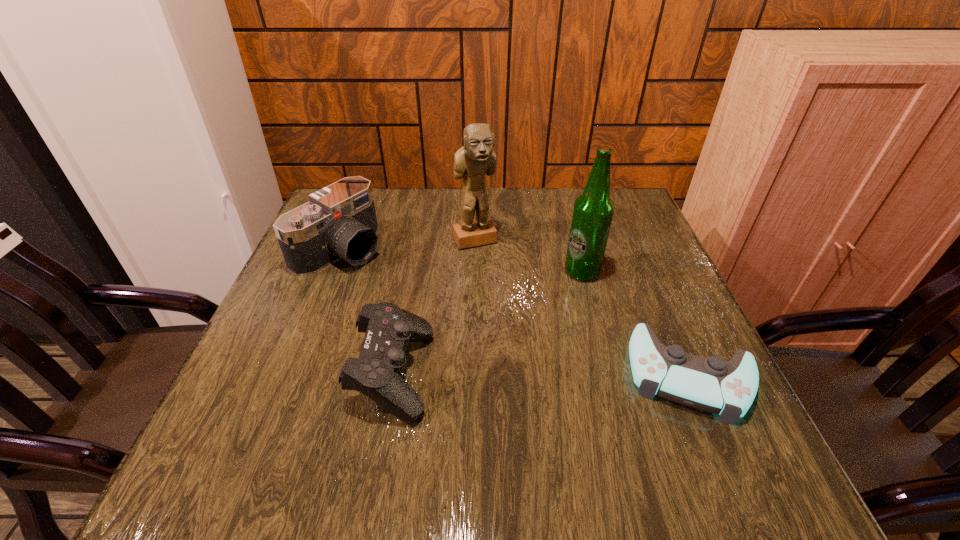
Locate an element on the screen. The height and width of the screenshot is (540, 960). the fourth object from right to left is located at coordinates (377, 372).

Find the location of a particular element. This screenshot has width=960, height=540. the taller control is located at coordinates (377, 372).

You are a GUI agent. You are given a task and a screenshot of the screen. Output one action in this format:
    pyautogui.click(x=<x>, y=<y>)
    Task: Click on the right control
    
    Given the screenshot: What is the action you would take?
    pyautogui.click(x=710, y=384)

I want to click on the shortest object, so click(710, 384).

Where is `camera`? Image resolution: width=960 pixels, height=540 pixels. camera is located at coordinates (339, 222).

Where is `the third shortest object`? the third shortest object is located at coordinates (339, 222).

Locate an element on the screen. the third object from right to left is located at coordinates 474,160.

Where is `beer bottle`? beer bottle is located at coordinates (593, 211).

Where is `free space located on the right of the second object from left to right`? The image size is (960, 540). free space located on the right of the second object from left to right is located at coordinates click(x=483, y=373).

The width and height of the screenshot is (960, 540). What are the coordinates of `vacant space located on the back of the shorter control` in the screenshot? It's located at (653, 288).